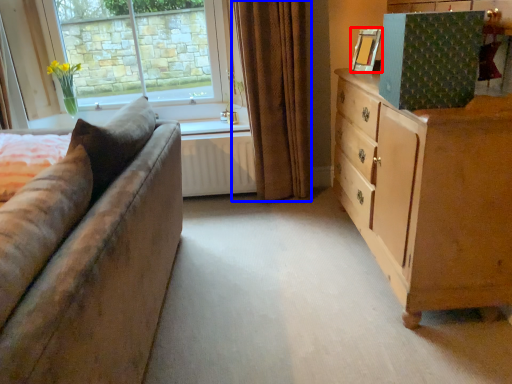
Question: Which object appears farthest to the camera in this image, picture frame (highlighted by a red box) or curtain (highlighted by a blue box)?

Choices:
 (A) picture frame
 (B) curtain

Answer: (B)